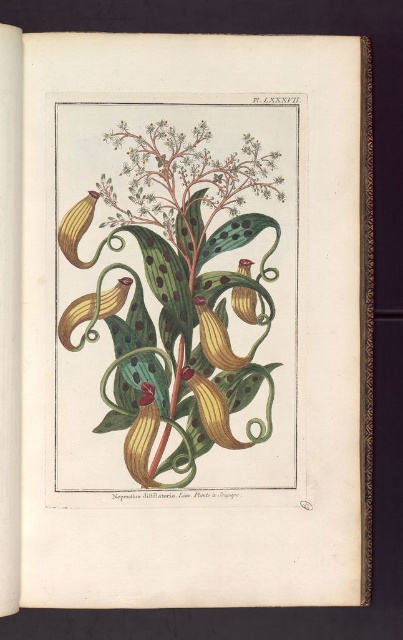
Who is lower down, yellow-green textured pod at center or green matte leaf at center?

green matte leaf at center is below.

Is point (120, 387) positioned in front of point (145, 396)?

Yes, it is.

This screenshot has width=403, height=640. What are the coordinates of `yellow-green textured pod at center` in the screenshot? It's located at (178, 292).